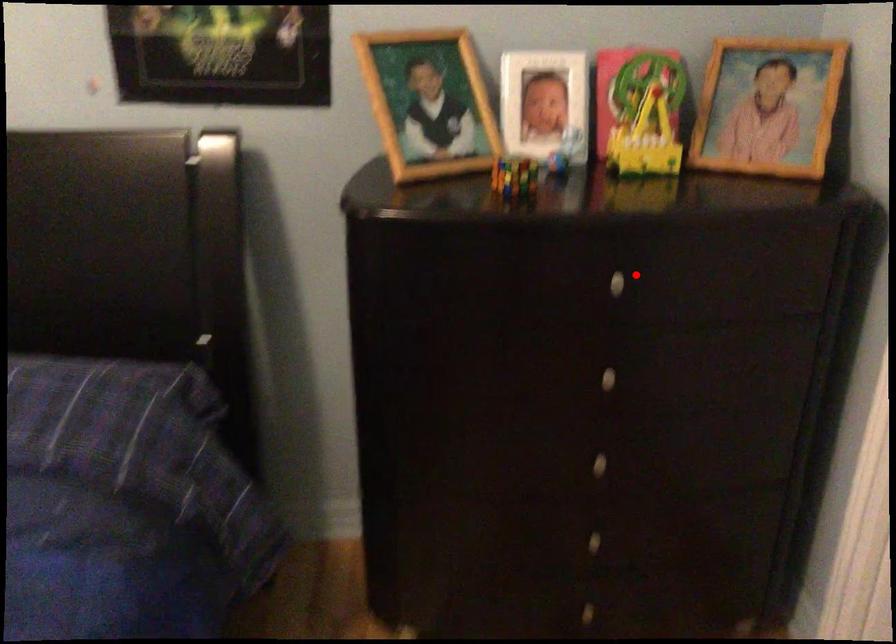
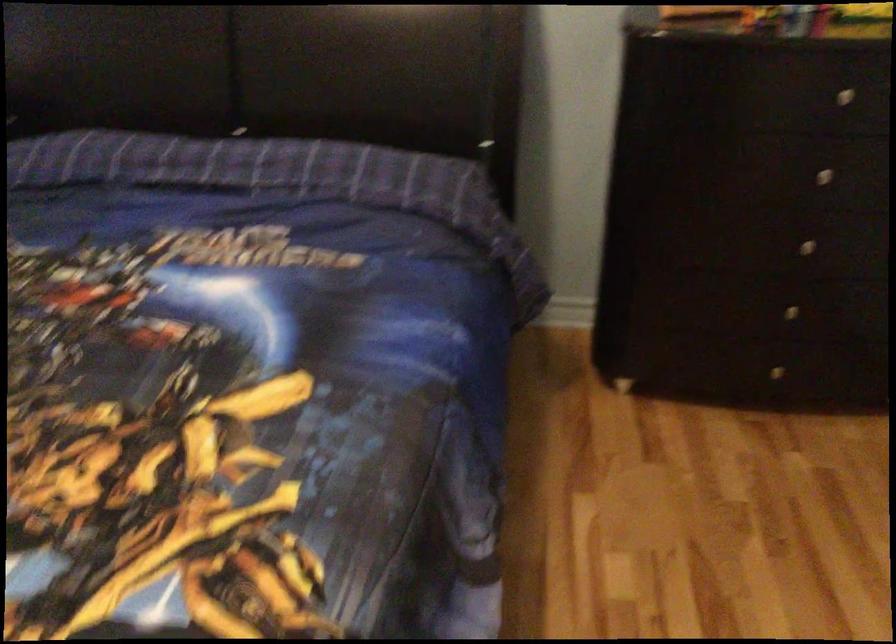
Find the pixel in the second image that matches the highlighted location in the first image.

(858, 91)